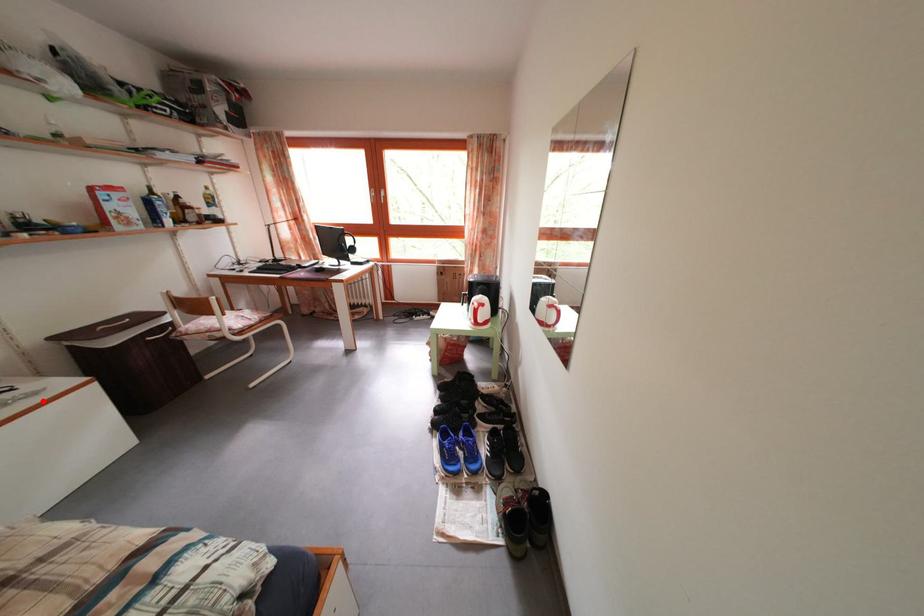
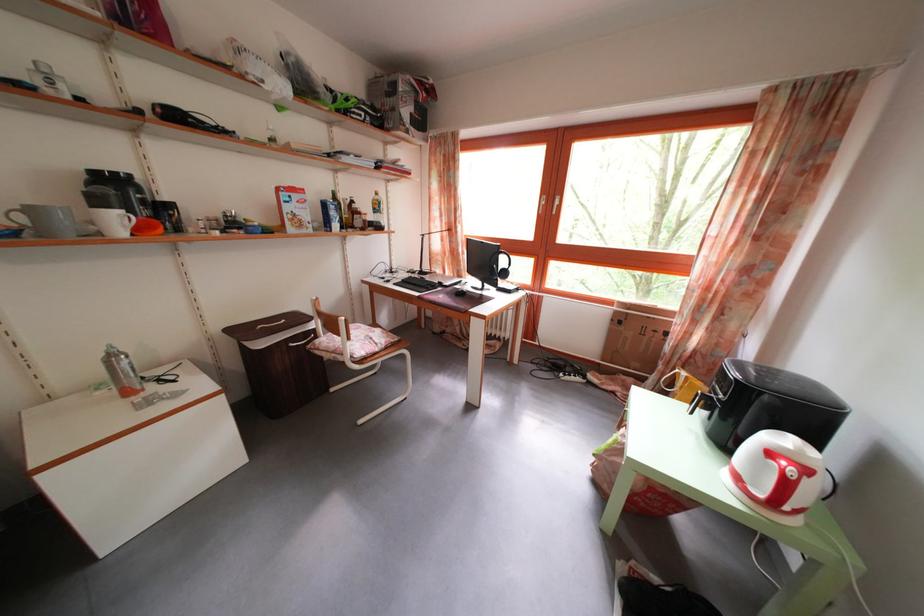
Where in the second image is the point corresponding to the highlighted location from the first image?

(185, 402)